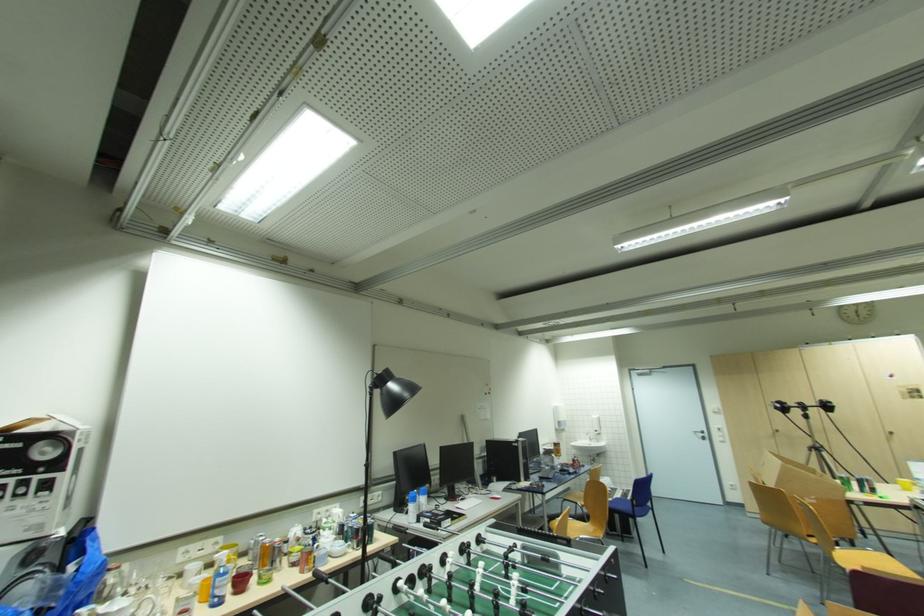
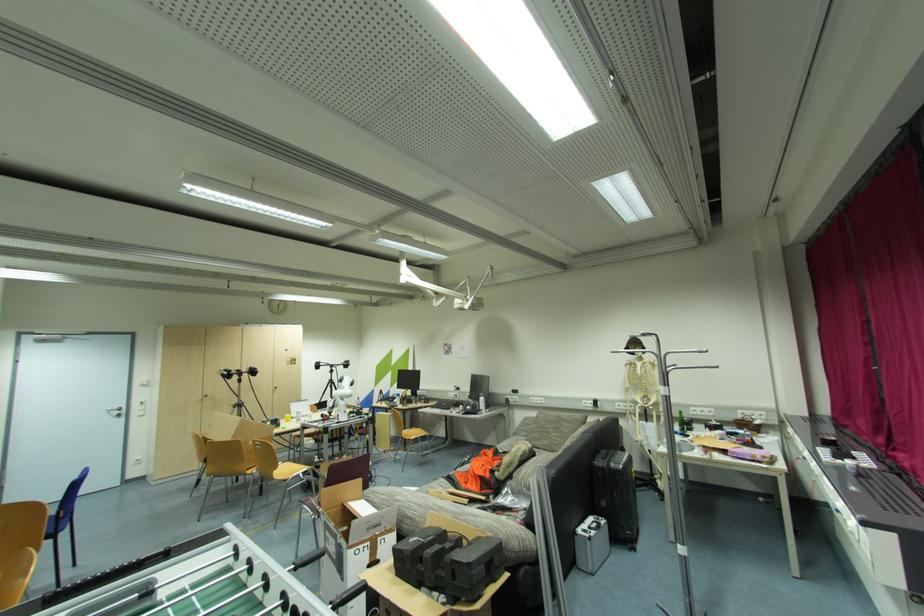
Locate, in the second image, the point that corresponds to [706,436] in the first image.

(122, 413)